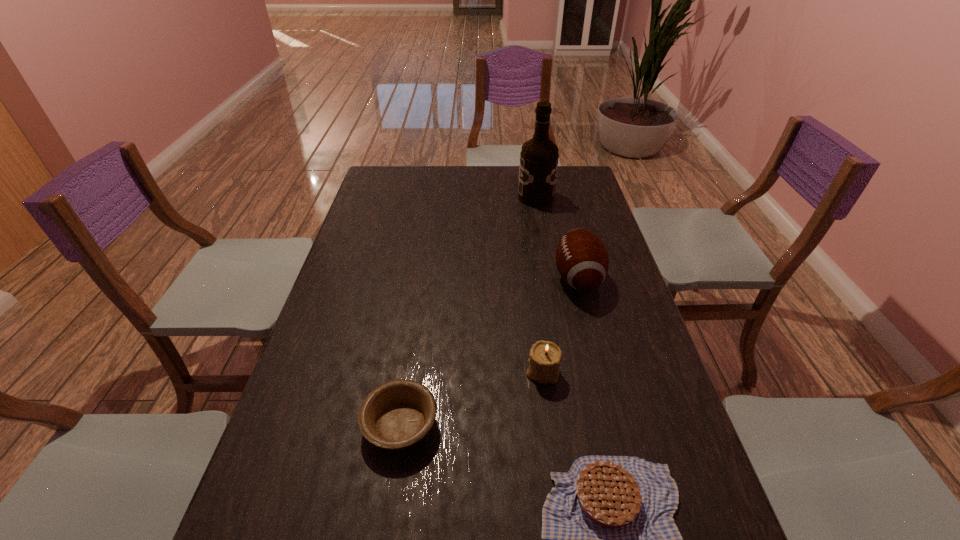
Identify the location of blank region between the tallest object and the candle_holder. Image resolution: width=960 pixels, height=540 pixels. (540, 284).

The width and height of the screenshot is (960, 540). What are the coordinates of `free space between the farthest object and the third tallest object` in the screenshot? It's located at (540, 284).

Identify the location of object that is the fourth closest to the tallest object. The width and height of the screenshot is (960, 540). (609, 538).

Locate an element on the screen. The width and height of the screenshot is (960, 540). the fourth closest object relative to the football is located at coordinates (609, 538).

You are a GUI agent. You are given a task and a screenshot of the screen. Output one action in this format:
    pyautogui.click(x=<x>, y=<y>)
    Task: Click on the vacant space that satisfies the following two spatial constraints: 1. on the label of the tallest object; 2. on the front side of the bowl
    
    Given the screenshot: What is the action you would take?
    pyautogui.click(x=577, y=425)